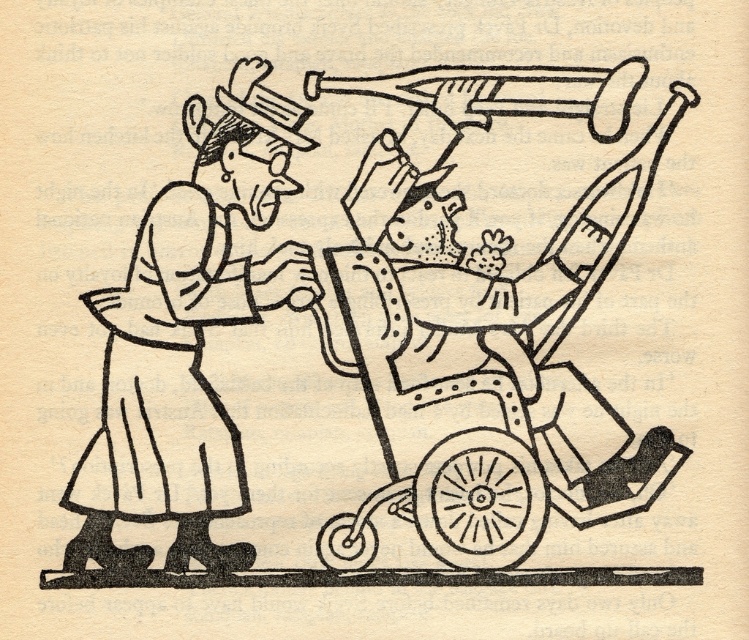
Based on the scene description, can you determine which object is wider between the metallic baby carriage at center and the smooth white dress at left?

The metallic baby carriage at center is wider than the smooth white dress at left according to the description.

In the vintage black and white drawing, there is a metallic baby carriage at center and a smooth white dress at left. Which object takes up more space in the image?

The metallic baby carriage at center is bigger than the smooth white dress at left, so it takes up more space in the image.

You are a photographer trying to capture a clear photo of the metallic baby carriage at center. Your camera requires the subject to be at least 1.5 meters away to focus properly. Based on the scene, will the carriage be in focus?

The metallic baby carriage at center is only 1.49 meters away from the camera, which is just below the required 1.5 meters. Therefore, the carriage may not be in focus.